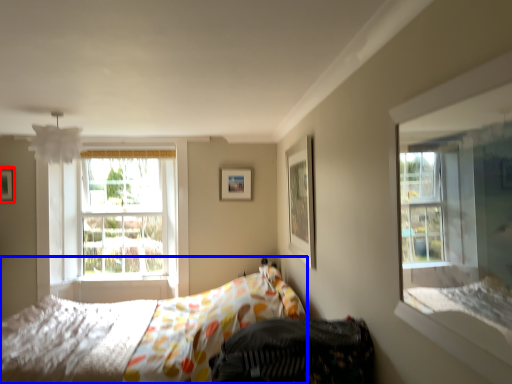
Question: Which object is further to the camera taking this photo, picture frame (highlighted by a red box) or bed (highlighted by a blue box)?

Choices:
 (A) picture frame
 (B) bed

Answer: (A)